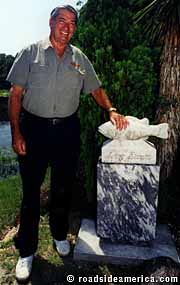
Locate an element on the screen. The height and width of the screenshot is (285, 180). plinth is located at coordinates (143, 251).